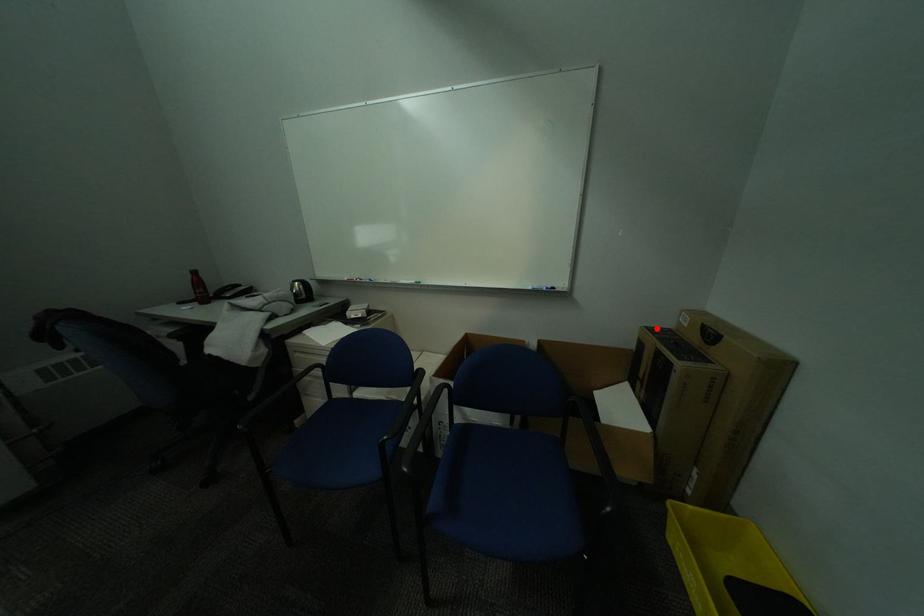
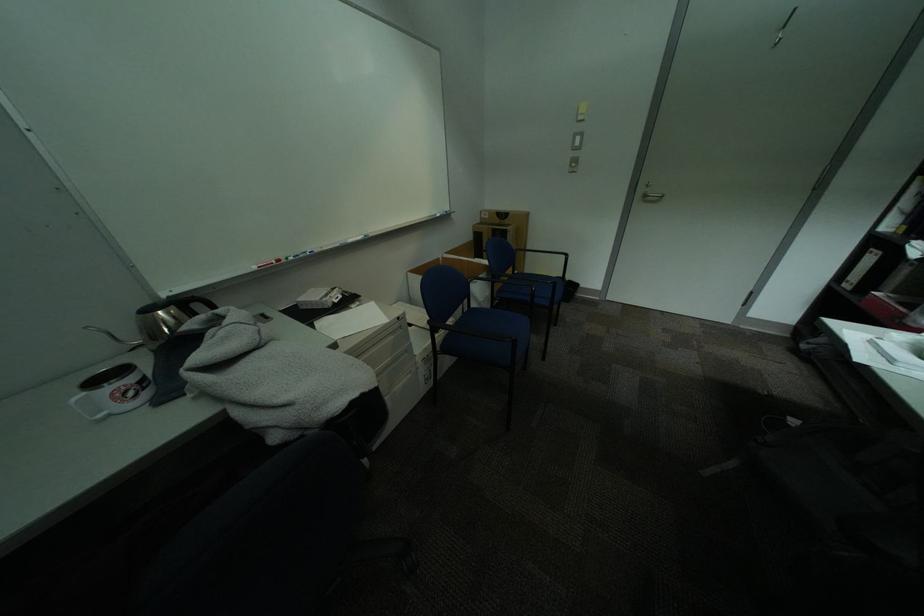
Question: I am providing you with two images of the same scene from different viewpoints. A red point is marked on the first image. At the location where the point appears in image 1, is it still visible in image 2?

Choices:
 (A) Yes
 (B) No

Answer: (A)